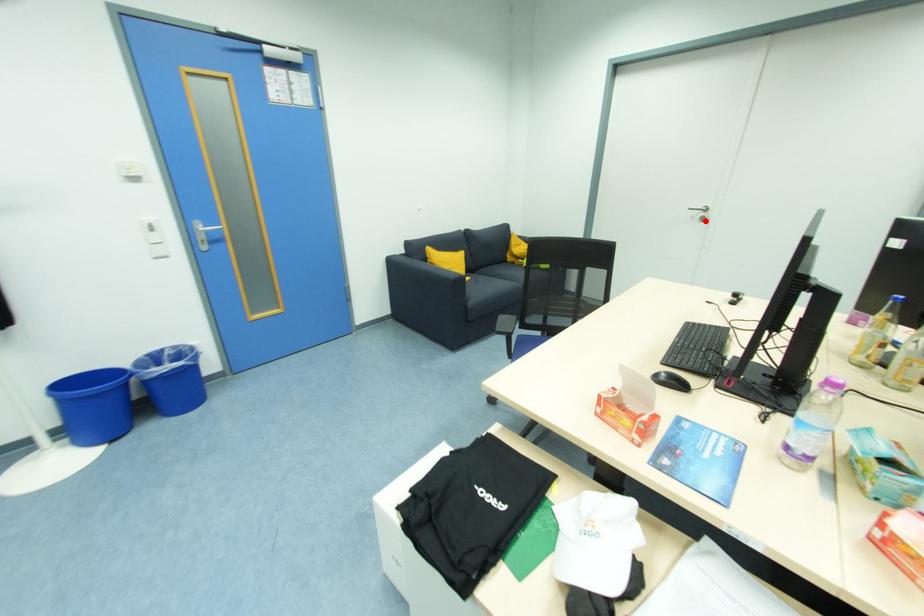
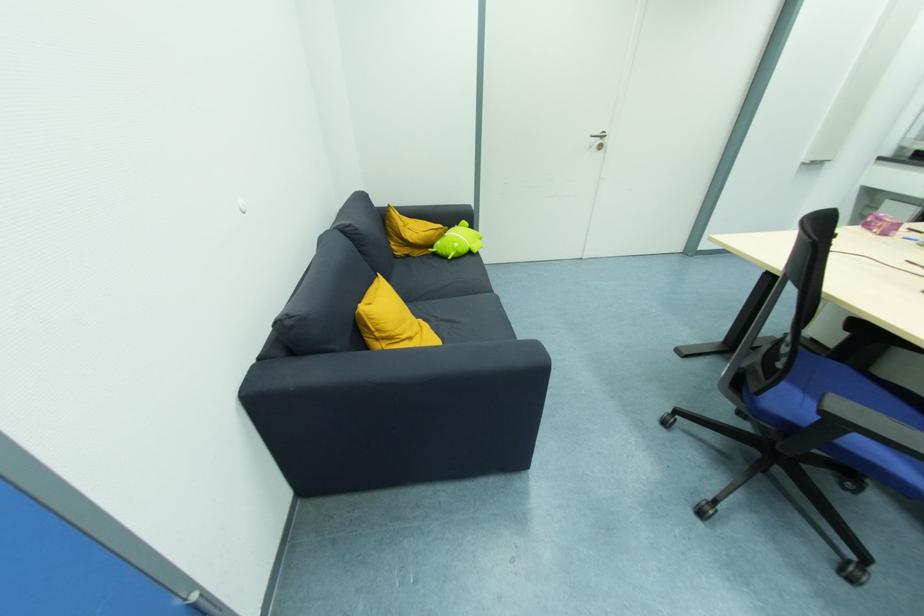
Find the pixel in the second image that matches the highlighted location in the first image.

(603, 148)